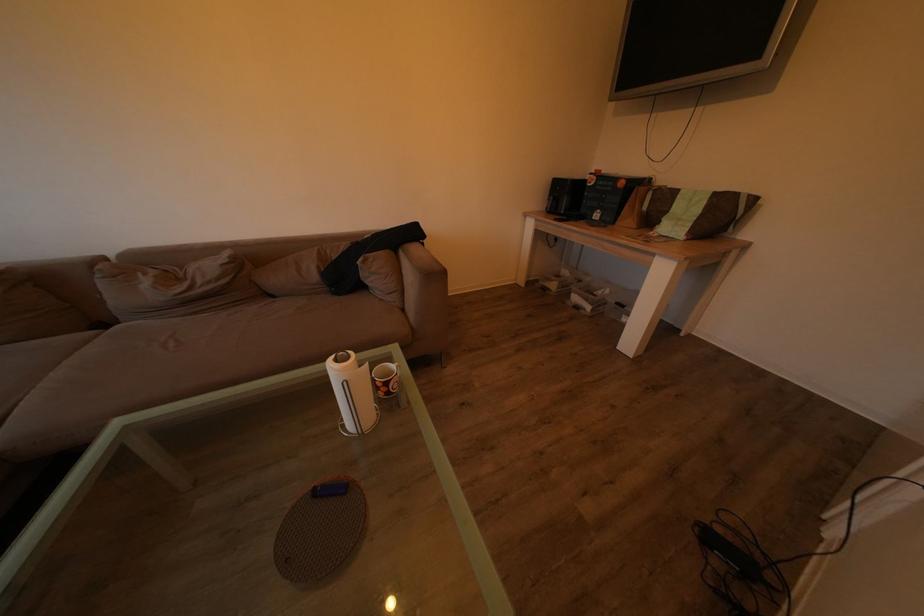
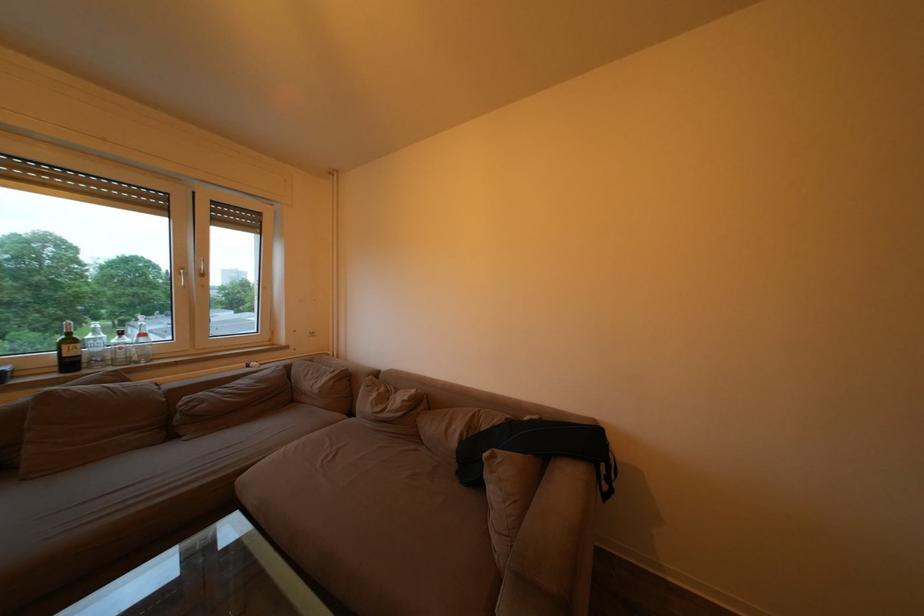
Question: The camera is either moving clockwise (left) or counter-clockwise (right) around the object. The first image is from the beginning of the video and the second image is from the end. Is the camera moving left or right when shooting the video?

Choices:
 (A) Left
 (B) Right

Answer: (B)